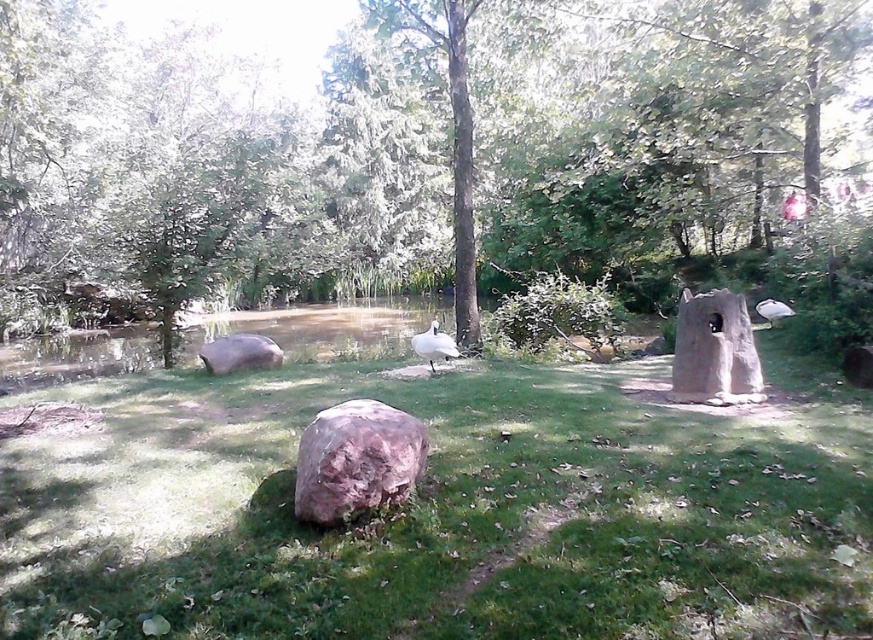
You are standing in the park and see a white matte bird at center. Where is the point at position (434, 346) located?

The point at position (434, 346) is located on the white matte bird at center.

You are planning to place a small garden ornament that is 1 meter wide on the green grassy area at center. Considering the size of the white glossy bird at upper right, can you determine if the green grassy at center has enough space to accommodate the ornament without overlapping the bird?

The green grassy at center might be wider than the white glossy bird at upper right, so there is a possibility that the grassy area has sufficient width to place the 1 meter wide ornament without overlapping the bird. However, the exact dimensions are uncertain based on the provided information.

You are a nature photographer holding a camera with a 2.5 meter focal length. You want to capture both the white matte bird at center and the white glossy bird at upper right in the same frame without moving the camera. Can you do this?

The distance between the white matte bird at center and the white glossy bird at upper right is 4.38 meters. Since the camera has a focal length of 2.5 meters, which is shorter than the distance between them, the photographer cannot capture both birds in the same frame without moving the camera.